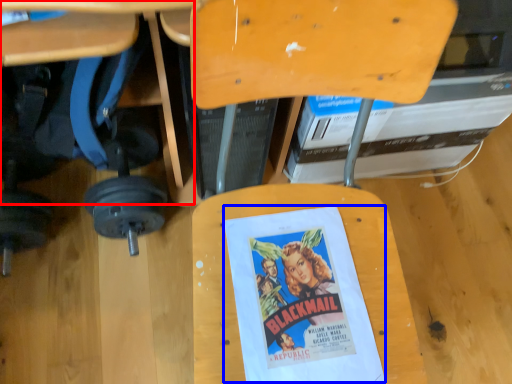
Question: Which of the following is the farthest to the observer, table (highlighted by a red box) or movie poster (highlighted by a blue box)?

Choices:
 (A) table
 (B) movie poster

Answer: (B)